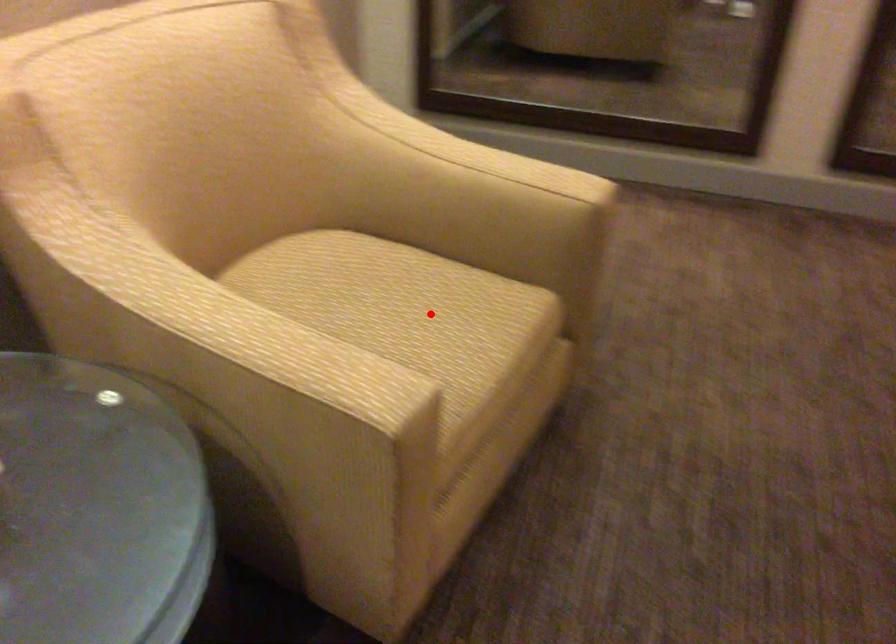
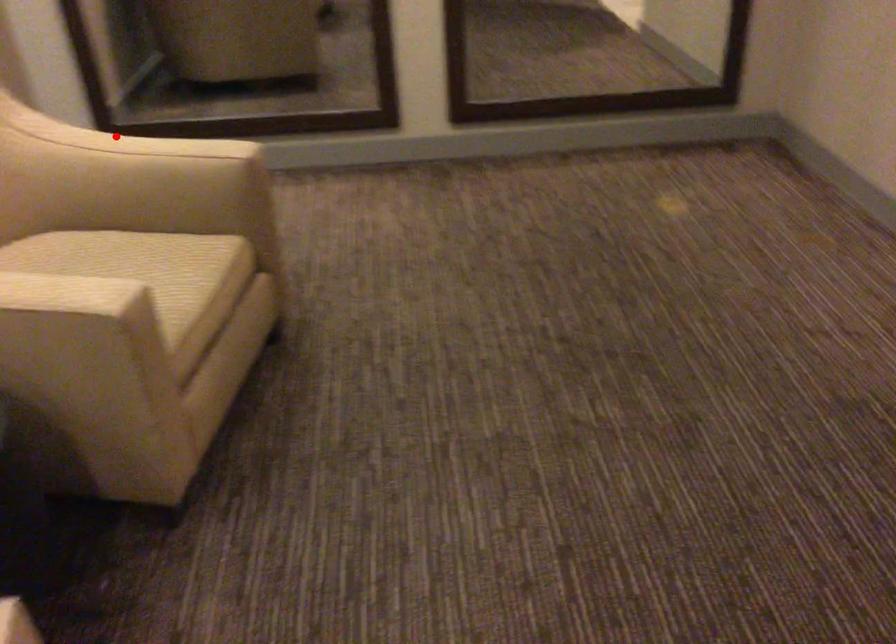
I am providing you with two images of the same scene from different viewpoints. A red point is marked on the first image and another point is marked on the second image. Do the highlighted points in image1 and image2 indicate the same real-world spot?

No